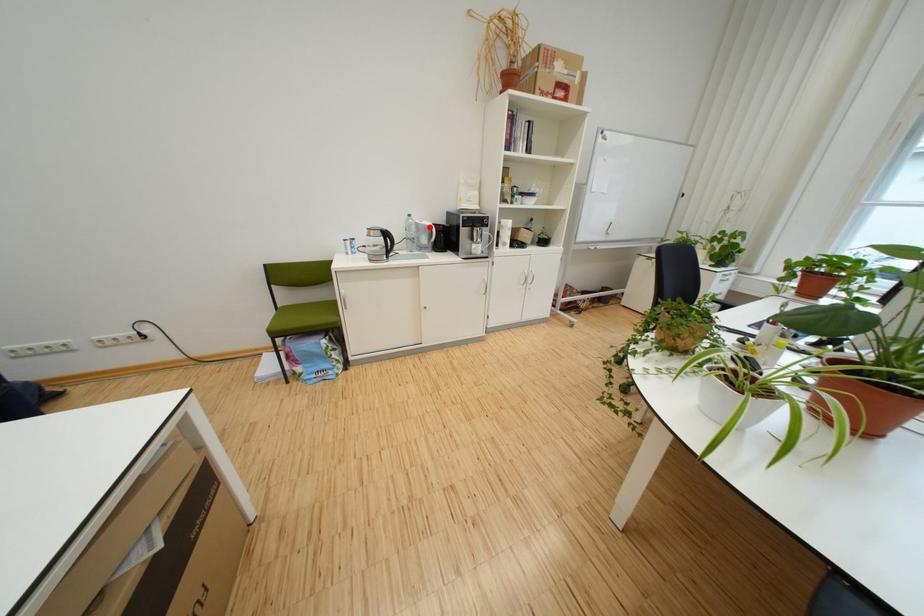
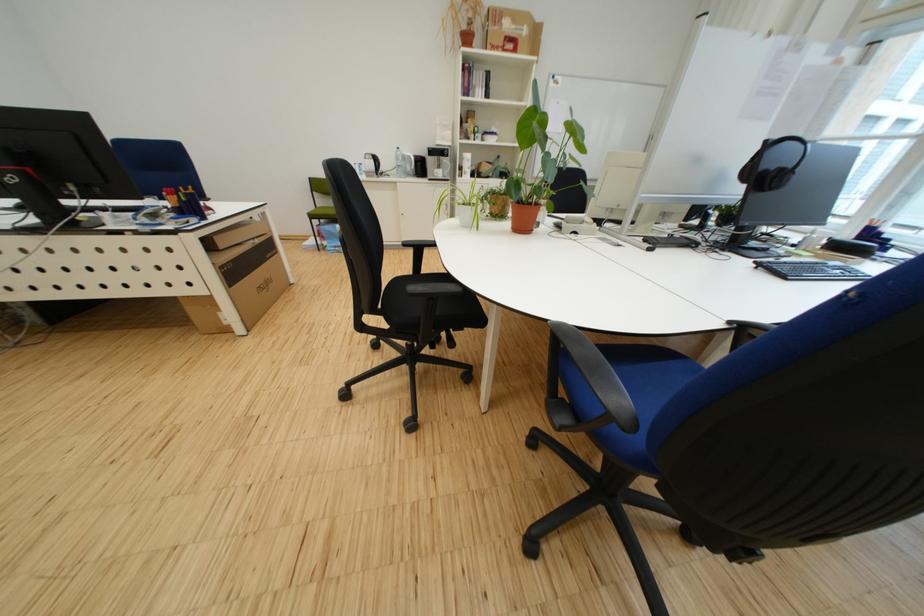
Question: I am providing you with two images of the same scene from different viewpoints. A red point is marked on the first image. At the location where the point appears in image 1, is it still visible in image 2?

Choices:
 (A) Yes
 (B) No

Answer: (A)